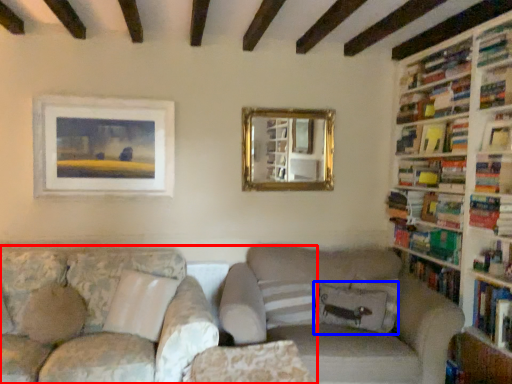
Question: Which object appears closest to the camera in this image, studio couch (highlighted by a red box) or pillow (highlighted by a blue box)?

Choices:
 (A) studio couch
 (B) pillow

Answer: (A)